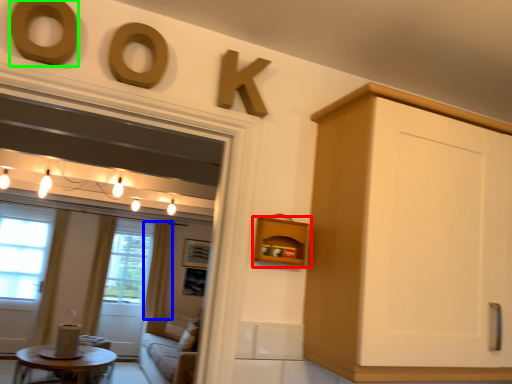
Question: Which object is positioned farthest from shelf (highlighted by a red box)? Select from curtain (highlighted by a blue box) and oval (highlighted by a green box).

Choices:
 (A) curtain
 (B) oval

Answer: (A)